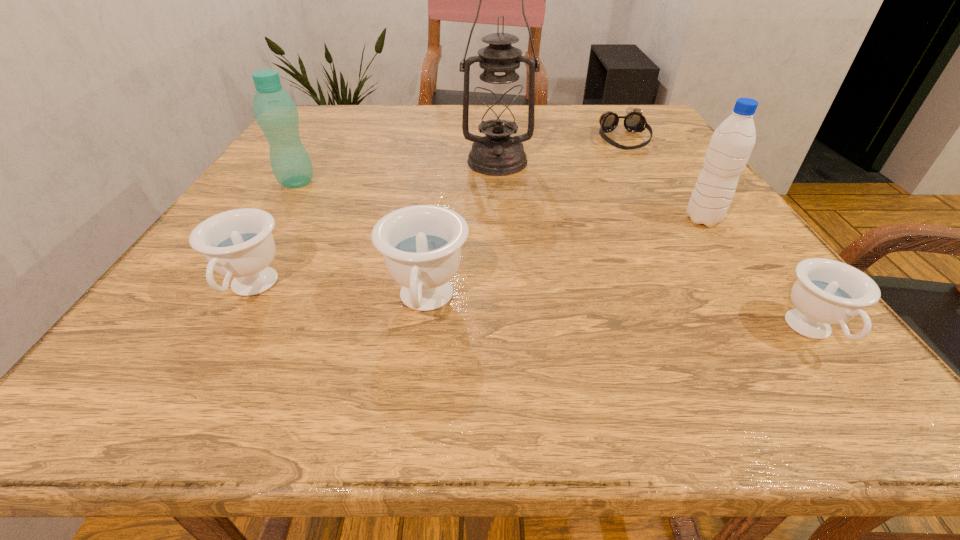
If equal spacing is desired by inserting an extra teacup among them, please point out a free spot for this new teacup. Please provide its 2D coordinates. Your answer should be formatted as a tuple, i.e. [(x, y)], where the tuple contains the x and y coordinates of a point satisfying the conditions above.

[(612, 317)]